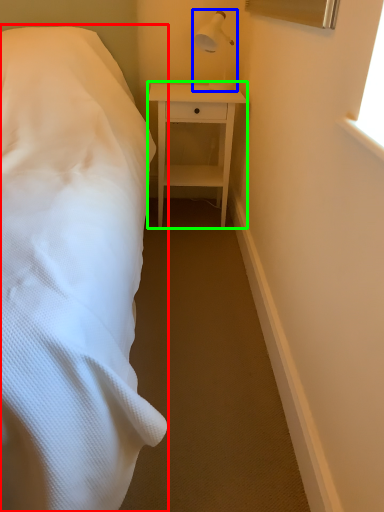
Question: Based on their relative distances, which object is farther from bed (highlighted by a red box)? Choose from bedside lamp (highlighted by a blue box) and nightstand (highlighted by a green box).

Choices:
 (A) bedside lamp
 (B) nightstand

Answer: (A)